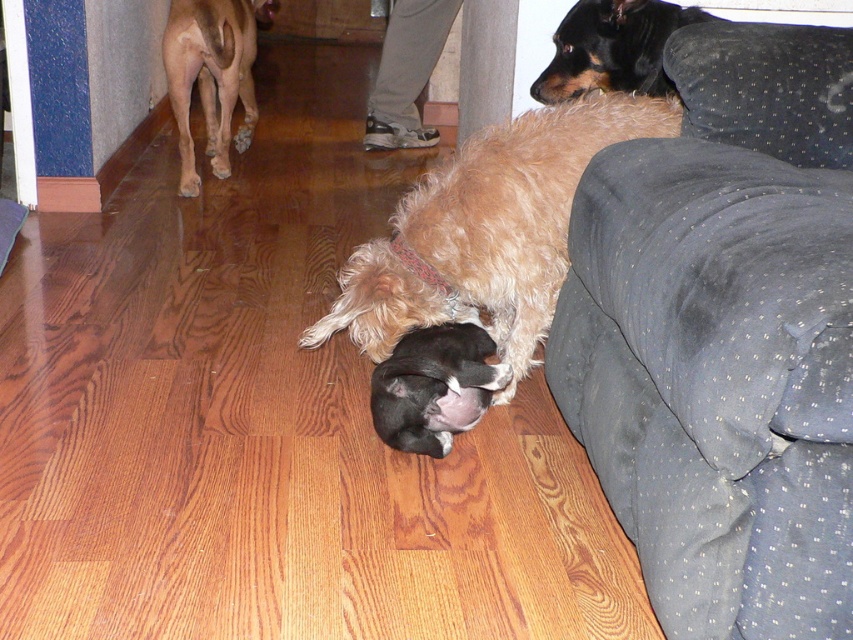
Question: Which object is positioned closest to the black smooth dog at upper right?

Choices:
 (A) black fur at center
 (B) fuzzy brown dog at upper right
 (C) fuzzy brown dog at center
 (D) smooth tan dog at upper left

Answer: (C)

Question: Is fuzzy brown dog at upper right to the right of fuzzy brown dog at center from the viewer's perspective?

Choices:
 (A) yes
 (B) no

Answer: (A)

Question: Which of these objects is positioned farthest from the smooth tan dog at upper left?

Choices:
 (A) black fur at center
 (B) black smooth dog at upper right
 (C) fuzzy brown dog at center
 (D) fuzzy brown dog at upper right

Answer: (D)

Question: Does fuzzy brown dog at center have a smaller size compared to black smooth dog at upper right?

Choices:
 (A) no
 (B) yes

Answer: (A)

Question: Which object is farther from the camera taking this photo?

Choices:
 (A) fuzzy brown dog at center
 (B) black fur at center
 (C) black smooth dog at upper right

Answer: (C)

Question: Is fuzzy brown dog at center below smooth tan dog at upper left?

Choices:
 (A) no
 (B) yes

Answer: (B)